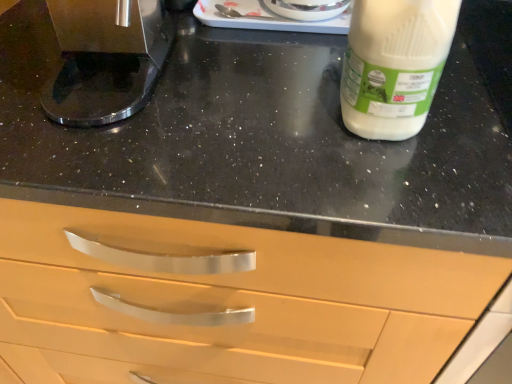
Identify the location of free space in front of shiny metallic coffee machine at left. The height and width of the screenshot is (384, 512). [141, 158].